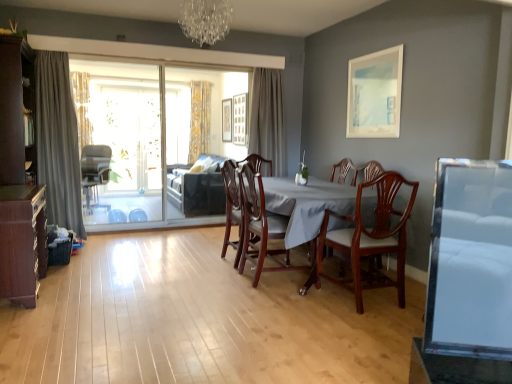
Question: Is point (166, 94) positioned closer to the camera than point (369, 125)?

Choices:
 (A) closer
 (B) farther

Answer: (B)

Question: Which is correct: transparent glass screen door at left is inside white matte picture frame at upper right, which is the first picture frame in front-to-back order, or outside of it?

Choices:
 (A) inside
 (B) outside

Answer: (B)

Question: Based on their relative distances, which object is nearer to the mahogany wood dining chair at center, the 2th chair from the front?

Choices:
 (A) transparent glass sliding door at center
 (B) mahogany wood table at center
 (C) transparent glass screen door at left
 (D) gray fabric curtain at center, which is counted as the 3th curtain, starting from the back
 (E) mahogany wood chair at center, the 2th chair when ordered from left to right

Answer: (E)

Question: Estimate the real-world distances between objects in this image. Which object is farther from the wooden cabinet at lower left?

Choices:
 (A) mahogany wood chair at center, placed as the second chair when sorted from back to front
 (B) transparent glass screen door at left
 (C) wooden picture frame at upper center, the 1th picture frame in the left-to-right sequence
 (D) white matte picture frame at upper right, which is the first picture frame in front-to-back order
 (E) crystal glass chandelier at upper center

Answer: (C)